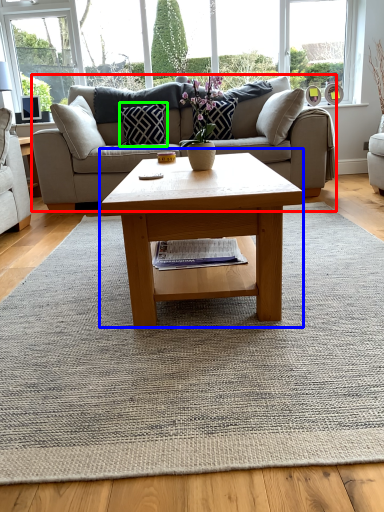
Question: Which object is the farthest from studio couch (highlighted by a red box)? Choose among these: coffee table (highlighted by a blue box) or pillow (highlighted by a green box).

Choices:
 (A) coffee table
 (B) pillow

Answer: (A)